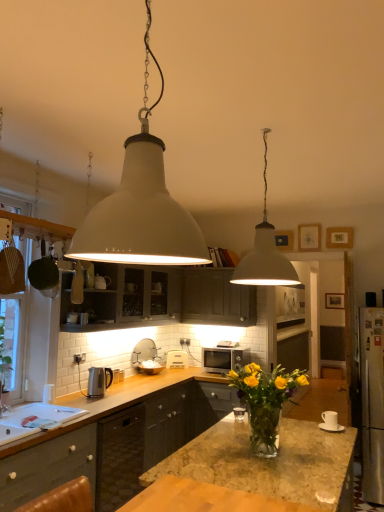
In order to face wooden picture frame at upper right, marked as the 2th picture frame in a top-to-bottom arrangement, should I rotate leftwards or rightwards?

Rotate your view right by about 19.281°.

Measure the distance between point [91,388] and camera.

Point [91,388] and camera are 3.47 meters apart from each other.

Locate an element on the screen. This screenshot has height=512, width=384. wooden picture frame at upper center, the 1th picture frame in the back-to-front sequence is located at coordinates (334, 300).

Measure the distance between white matte pendant light at upper center, which is counted as the 1th lamp, starting from the left, and camera.

white matte pendant light at upper center, which is counted as the 1th lamp, starting from the left, and camera are 38.46 inches apart.

Describe the element at coordinates (309, 237) in the screenshot. The image size is (384, 512). I see `white matte picture frame at upper center, which is the second picture frame in back-to-front order` at that location.

The image size is (384, 512). Find the location of `wooden picture frame at upper right, the second picture frame viewed from the right`. wooden picture frame at upper right, the second picture frame viewed from the right is located at coordinates (339, 238).

From a real-world perspective, who is located lower, white matte picture frame at upper center, which is the second picture frame in back-to-front order, or polished stainless steel kettle at lower left, acting as the first appliance starting from the front?

polished stainless steel kettle at lower left, acting as the first appliance starting from the front.

Is white matte picture frame at upper center, which is the second picture frame in back-to-front order, with polished stainless steel kettle at lower left, acting as the first appliance starting from the front?

white matte picture frame at upper center, which is the second picture frame in back-to-front order, and polished stainless steel kettle at lower left, acting as the first appliance starting from the front, are not in contact.

Considering the sizes of objects white matte picture frame at upper center, the third picture frame from the right, and polished stainless steel kettle at lower left, arranged as the 2th appliance when viewed from the back, in the image provided, who is taller, white matte picture frame at upper center, the third picture frame from the right, or polished stainless steel kettle at lower left, arranged as the 2th appliance when viewed from the back,?

With more height is white matte picture frame at upper center, the third picture frame from the right.

How much distance is there between white matte picture frame at upper center, which is the second picture frame in back-to-front order, and polished stainless steel kettle at lower left, the 2th appliance positioned from the bottom?

white matte picture frame at upper center, which is the second picture frame in back-to-front order, is 2.55 meters away from polished stainless steel kettle at lower left, the 2th appliance positioned from the bottom.

Who is shorter, polished stainless steel kettle at lower left, arranged as the 2th appliance when viewed from the back, or wooden picture frame at upper right, placed as the 1th picture frame when sorted from front to back?

Standing shorter between the two is wooden picture frame at upper right, placed as the 1th picture frame when sorted from front to back.

Does polished stainless steel kettle at lower left, arranged as the 2th appliance when viewed from the back, have a smaller size compared to wooden picture frame at upper right, which ranks as the second picture frame in bottom-to-top order?

No.

Is polished stainless steel kettle at lower left, the 2th appliance positioned from the bottom, looking in the opposite direction of wooden picture frame at upper right, the 3th picture frame from the back?

polished stainless steel kettle at lower left, the 2th appliance positioned from the bottom, is not turned away from wooden picture frame at upper right, the 3th picture frame from the back.

Considering the relative positions of polished stainless steel kettle at lower left, acting as the first appliance starting from the front, and wooden picture frame at upper right, which ranks as the second picture frame in bottom-to-top order, in the image provided, is polished stainless steel kettle at lower left, acting as the first appliance starting from the front, behind wooden picture frame at upper right, which ranks as the second picture frame in bottom-to-top order,?

No.

Are granite countertop at center and white matte pendant light at upper center, which appears as the 1th lamp when viewed from the back, located far from each other?

No.

In the scene shown: Would you say granite countertop at center is to the left or to the right of white matte pendant light at upper center, which appears as the 1th lamp when viewed from the back, in the picture?

From the image, it's evident that granite countertop at center is to the right of white matte pendant light at upper center, which appears as the 1th lamp when viewed from the back.

Is granite countertop at center positioned behind white matte pendant light at upper center, which appears as the 1th lamp when viewed from the back?

Yes, it is behind white matte pendant light at upper center, which appears as the 1th lamp when viewed from the back.

In the scene shown: Is white glossy sink at lower left inside or outside of translucent glass vase at center?

white glossy sink at lower left is spatially situated outside translucent glass vase at center.

From the image's perspective, is white glossy sink at lower left over translucent glass vase at center?

No, from the image's perspective, white glossy sink at lower left is not on top of translucent glass vase at center.

Considering the sizes of objects white glossy sink at lower left and translucent glass vase at center in the image provided, who is thinner, white glossy sink at lower left or translucent glass vase at center?

translucent glass vase at center is thinner.

Does white glossy sink at lower left lie behind translucent glass vase at center?

Yes.

Is point (91, 379) closer or farther from the camera than point (312, 236)?

Point (91, 379).

Based on the photo, does polished stainless steel kettle at lower left, arranged as the 2th appliance when viewed from the back, have a greater height compared to white matte picture frame at upper center, which is the second picture frame in back-to-front order?

In fact, polished stainless steel kettle at lower left, arranged as the 2th appliance when viewed from the back, may be shorter than white matte picture frame at upper center, which is the second picture frame in back-to-front order.

From the image's perspective, which one is positioned higher, polished stainless steel kettle at lower left, which is the first appliance from left to right, or white matte picture frame at upper center, which is the 3th picture frame in bottom-to-top order?

white matte picture frame at upper center, which is the 3th picture frame in bottom-to-top order, is shown above in the image.

Is polished stainless steel kettle at lower left, which is the first appliance from top to bottom, not close to white matte picture frame at upper center, the third picture frame from the right?

polished stainless steel kettle at lower left, which is the first appliance from top to bottom, is positioned a significant distance from white matte picture frame at upper center, the third picture frame from the right.

Could you tell me if matte gray cabinets at lower left, positioned as the 1th cabinetry in front-to-back order, is turned towards white matte pendant light at upper center, which appears as the 1th lamp when viewed from the back?

No, matte gray cabinets at lower left, positioned as the 1th cabinetry in front-to-back order, is not aimed at white matte pendant light at upper center, which appears as the 1th lamp when viewed from the back.

Does matte gray cabinets at lower left, positioned as the 1th cabinetry in front-to-back order, have a lesser width compared to white matte pendant light at upper center, the second lamp in the front-to-back sequence?

In fact, matte gray cabinets at lower left, positioned as the 1th cabinetry in front-to-back order, might be wider than white matte pendant light at upper center, the second lamp in the front-to-back sequence.

How different are the orientations of matte gray cabinets at lower left, positioned as the 1th cabinetry in front-to-back order, and white matte pendant light at upper center, which is counted as the second lamp, starting from the left, in degrees?

The angle between the facing direction of matte gray cabinets at lower left, positioned as the 1th cabinetry in front-to-back order, and the facing direction of white matte pendant light at upper center, which is counted as the second lamp, starting from the left, is 91.4 degrees.

Which object is closer to the camera, matte gray cabinets at lower left, positioned as the 1th cabinetry in front-to-back order, or white matte picture frame at upper center, which is the second picture frame in back-to-front order?

matte gray cabinets at lower left, positioned as the 1th cabinetry in front-to-back order, is closer to the camera.

Between point (15, 479) and point (304, 244), which one is positioned behind?

Point (304, 244)

Is matte gray cabinets at lower left, positioned as the 1th cabinetry in front-to-back order, surrounding white matte picture frame at upper center, which is the 3th picture frame in bottom-to-top order?

No.

Find the location of a particular element. This screenshot has width=384, height=512. appliance that is the 1st object directly below the white matte picture frame at upper center, which is the second picture frame in back-to-front order (from a real-world perspective) is located at coordinates (98, 381).

Where is `the 2nd appliance to the left of the wooden picture frame at upper right, marked as the 2th picture frame in a left-to-right arrangement, starting your count from the anchor`? This screenshot has height=512, width=384. the 2nd appliance to the left of the wooden picture frame at upper right, marked as the 2th picture frame in a left-to-right arrangement, starting your count from the anchor is located at coordinates (98, 381).

Based on their spatial positions, is matte gray cabinet at upper center, the 2th cabinetry positioned from the back, or dark gray wood cabinet at center, which is the third cabinetry from front to back, closer to granite countertop at center?

matte gray cabinet at upper center, the 2th cabinetry positioned from the back, is positioned closer to the anchor granite countertop at center.

From the image, which object appears to be nearer to translucent glass vase at center, wooden picture frame at upper right, placed as the 1th picture frame when sorted from front to back, or white matte pendant light at upper center, which is counted as the 1th lamp, starting from the left?

white matte pendant light at upper center, which is counted as the 1th lamp, starting from the left.

Looking at the image, which one is located further to white matte picture frame at upper center, the third picture frame from the right, white matte microwave at center, marked as the second appliance in a front-to-back arrangement, or satin silver microwave at center?

white matte microwave at center, marked as the second appliance in a front-to-back arrangement, is further to white matte picture frame at upper center, the third picture frame from the right.

Estimate the real-world distances between objects in this image. Which object is closer to white glossy sink at lower left, granite countertop at center or wooden picture frame at upper right, the second picture frame viewed from the right?

The object closer to white glossy sink at lower left is granite countertop at center.

Which object lies further to the anchor point white matte picture frame at upper center, arranged as the 1th picture frame when viewed from the left, granite countertop at center or wooden picture frame at upper right, marked as the 2th picture frame in a top-to-bottom arrangement?

Based on the image, granite countertop at center appears to be further to white matte picture frame at upper center, arranged as the 1th picture frame when viewed from the left.

In the scene shown: Based on their spatial positions, is satin silver microwave at center or white matte microwave at center, which ranks as the 2th appliance in top-to-bottom order, closer to matte gray cabinet at upper center, which is the 2th cabinetry in front-to-back order?

satin silver microwave at center is closer to matte gray cabinet at upper center, which is the 2th cabinetry in front-to-back order.

Considering their positions, is white matte picture frame at upper center, arranged as the 1th picture frame when viewed from the left, positioned further to white glossy sink at lower left than wooden picture frame at upper center, the 1th picture frame in the back-to-front sequence?

wooden picture frame at upper center, the 1th picture frame in the back-to-front sequence, lies further to white glossy sink at lower left than the other object.

Based on their spatial positions, is satin silver microwave at center or white matte pendant light at upper center, the second lamp in the front-to-back sequence, further from white matte picture frame at upper center, which is the second picture frame in back-to-front order?

white matte pendant light at upper center, the second lamp in the front-to-back sequence, is further to white matte picture frame at upper center, which is the second picture frame in back-to-front order.

Where is `lamp located between matte gray cabinets at lower left, arranged as the 3th cabinetry when viewed from the back, and white matte microwave at center, marked as the second appliance in a front-to-back arrangement, in the depth direction`? lamp located between matte gray cabinets at lower left, arranged as the 3th cabinetry when viewed from the back, and white matte microwave at center, marked as the second appliance in a front-to-back arrangement, in the depth direction is located at coordinates (265, 252).

Image resolution: width=384 pixels, height=512 pixels. Identify the location of picture frame located between white matte pendant light at upper center, which ranks as the 1th lamp in front-to-back order, and white matte picture frame at upper center, which is the second picture frame in back-to-front order, in the depth direction. click(339, 238).

Locate an element on the screen. Image resolution: width=384 pixels, height=512 pixels. floral arrangement between white matte pendant light at upper center, the second lamp viewed from the back, and polished stainless steel kettle at lower left, the 2th appliance positioned from the bottom, along the z-axis is located at coordinates (265, 401).

You are a GUI agent. You are given a task and a screenshot of the screen. Output one action in this format:
    pyautogui.click(x=<x>, y=<y>)
    Task: Click on the floral arrangement between matte gray cabinets at lower left, arranged as the 3th cabinetry when viewed from the back, and white matte pendant light at upper center, which appears as the 1th lamp when viewed from the back
    
    Given the screenshot: What is the action you would take?
    pyautogui.click(x=265, y=401)